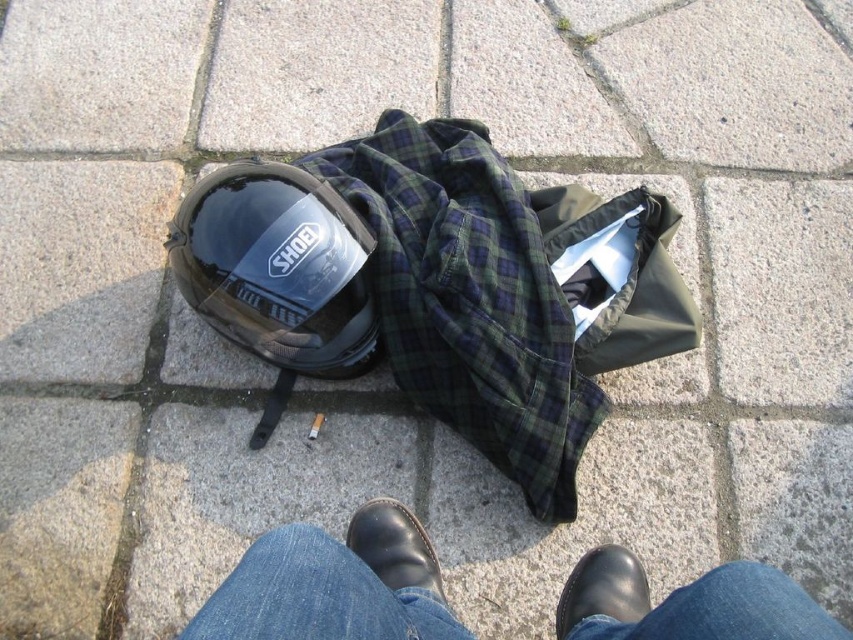
Based on the photo, you are a delivery person who needs to pick up an item from the scene. You see the green plaid shirt at center and the black leather shoe at lower center. Which item is closer to you?

The green plaid shirt at center is located above the black leather shoe at lower center, so it is closer to you.

You are standing on the paved surface and want to pick up both the green plaid shirt at center and the jeans at lower center. Which item should you reach for first if you want to pick up the one closer to your current position?

The jeans at lower center is closer to your current position because the green plaid shirt at center is to the left of it, implying it is farther away.